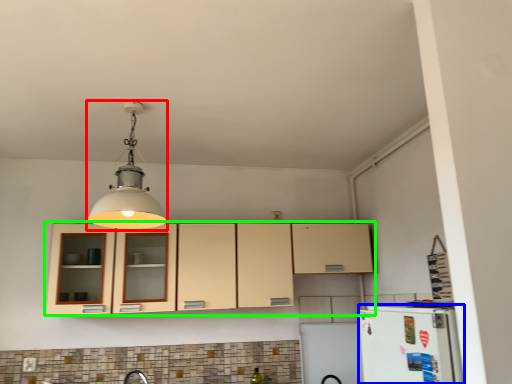
Question: Considering the real-world distances, which object is farthest from light fixture (highlighted by a red box)? appliance (highlighted by a blue box) or cabinetry (highlighted by a green box)?

Choices:
 (A) appliance
 (B) cabinetry

Answer: (A)